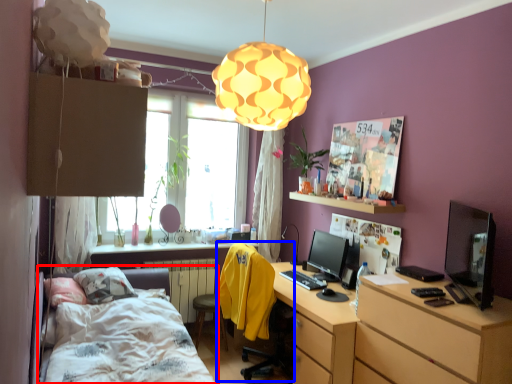
Question: Which object appears closest to the camera in this image, bed (highlighted by a red box) or computer chair (highlighted by a blue box)?

Choices:
 (A) bed
 (B) computer chair

Answer: (A)